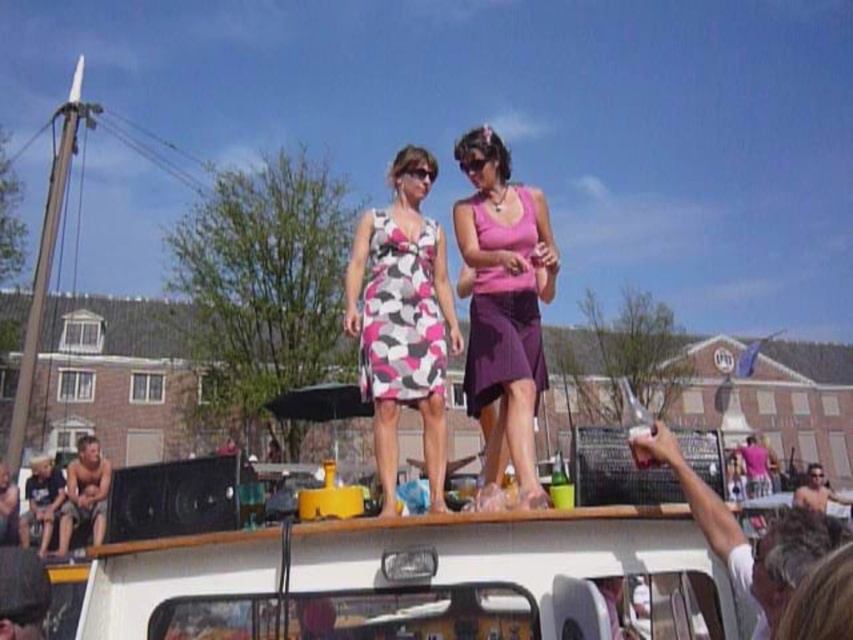
Between pink and white patterned dress at center and purple satin dress at upper center, which one is positioned higher?

Positioned higher is purple satin dress at upper center.

Between pink and white patterned dress at center and purple satin dress at upper center, which one appears on the left side from the viewer's perspective?

pink and white patterned dress at center is more to the left.

Is point (392, 250) closer to camera compared to point (521, 342)?

No, it is behind (521, 342).

Where is `pink and white patterned dress at center`? pink and white patterned dress at center is located at coordinates (399, 316).

Does pink matte tank top at upper center appear on the left side of pink and white patterned dress at center?

In fact, pink matte tank top at upper center is to the right of pink and white patterned dress at center.

Does pink matte tank top at upper center have a larger size compared to pink and white patterned dress at center?

Correct, pink matte tank top at upper center is larger in size than pink and white patterned dress at center.

Where is `pink matte tank top at upper center`? Image resolution: width=853 pixels, height=640 pixels. pink matte tank top at upper center is located at coordinates (503, 305).

Who is higher up, pink and white printed dress at center or pink matte tank top at upper center?

pink matte tank top at upper center

Does pink and white printed dress at center appear over pink matte tank top at upper center?

No, pink and white printed dress at center is not above pink matte tank top at upper center.

Describe the element at coordinates (403, 321) in the screenshot. This screenshot has width=853, height=640. I see `pink and white printed dress at center` at that location.

At what (x,y) coordinates should I click in order to perform the action: click on pink and white printed dress at center. Please return your answer as a coordinate pair (x, y). The height and width of the screenshot is (640, 853). Looking at the image, I should click on (403, 321).